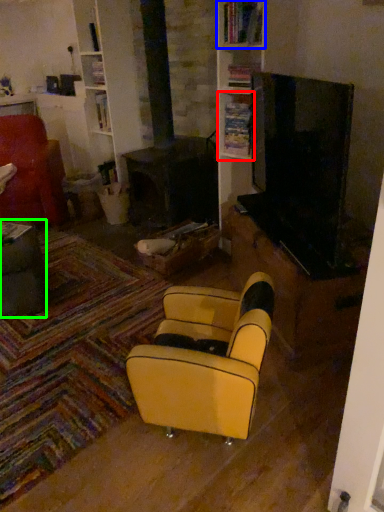
Question: Based on their relative distances, which object is nearer to shelf (highlighted by a red box)? Choose from shelf (highlighted by a blue box) and table (highlighted by a green box).

Choices:
 (A) shelf
 (B) table

Answer: (A)